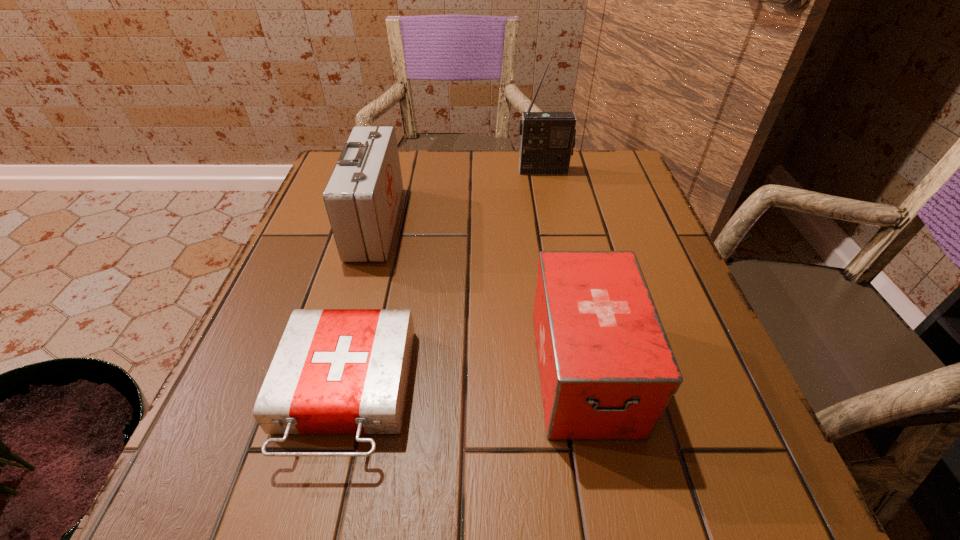
What are the coordinates of `the farthest object` in the screenshot? It's located at (547, 140).

Where is `radio receiver`? radio receiver is located at coordinates (547, 140).

Locate an element on the screen. This screenshot has width=960, height=540. the farthest first-aid kit is located at coordinates (362, 197).

You are a GUI agent. You are given a task and a screenshot of the screen. Output one action in this format:
    pyautogui.click(x=<x>, y=<y>)
    Task: Click on the rightmost first-aid kit
    The width and height of the screenshot is (960, 540).
    Given the screenshot: What is the action you would take?
    pyautogui.click(x=607, y=371)

This screenshot has width=960, height=540. What are the coordinates of `the third tallest object` in the screenshot? It's located at (607, 371).

Where is `the shortest object`? This screenshot has height=540, width=960. the shortest object is located at coordinates (336, 371).

Image resolution: width=960 pixels, height=540 pixels. I want to click on vacant space located 0.060m on the display of the tallest object, so click(547, 188).

You are a GUI agent. You are given a task and a screenshot of the screen. Output one action in this format:
    pyautogui.click(x=<x>, y=<y>)
    Task: Click on the vacant region located 0.380m on the front-facing side of the third nearest object
    This screenshot has width=960, height=540.
    Given the screenshot: What is the action you would take?
    pyautogui.click(x=565, y=223)

Image resolution: width=960 pixels, height=540 pixels. Identify the location of vacant space located on the handle side of the second shortest object. (606, 481).

This screenshot has width=960, height=540. I want to click on vacant space located on the front side of the shortest first-aid kit, so click(x=313, y=521).